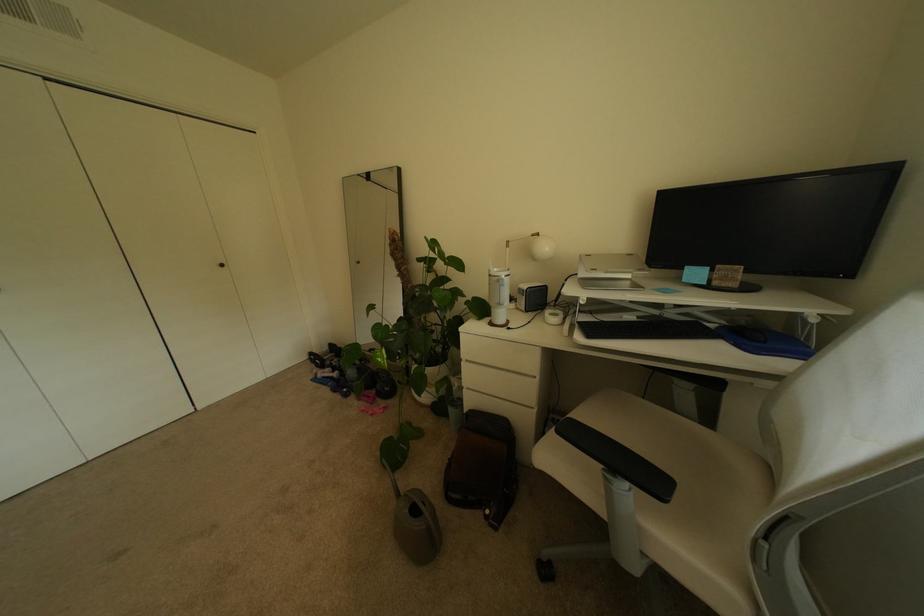
The location [497,296] corresponds to which object?

It corresponds to the grey watering can in the image.